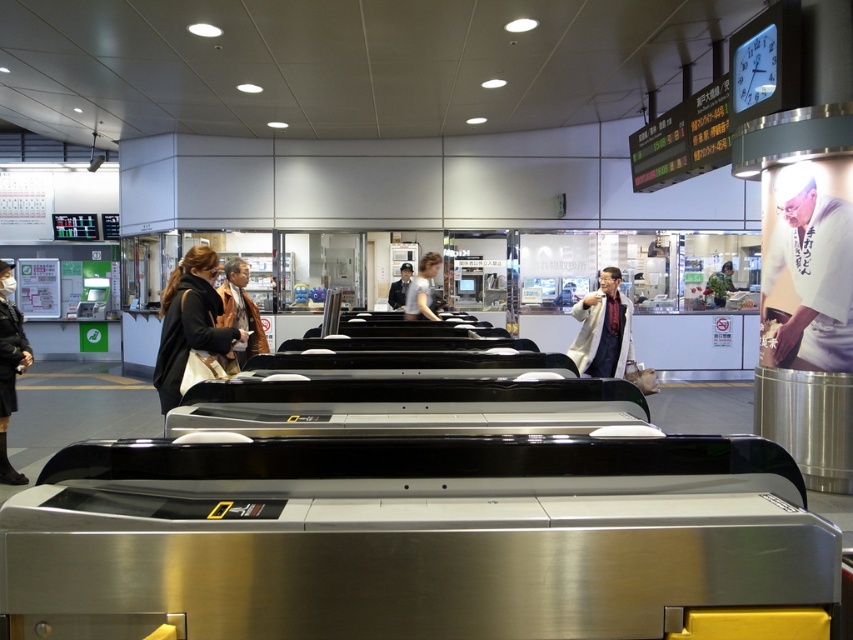
Question: Which object appears closest to the camera in this image?

Choices:
 (A) dark blue suit at center
 (B) white cotton shirt at upper right
 (C) matte black coat at center
 (D) light brown leather jacket at upper right

Answer: (C)

Question: From the image, what is the correct spatial relationship of brown leather jacket at center in relation to matte black jacket at center?

Choices:
 (A) below
 (B) above

Answer: (A)

Question: Where is light brown leather jacket at upper right located in relation to dark blue suit at center in the image?

Choices:
 (A) below
 (B) above

Answer: (B)

Question: In this image, where is matte black jacket at center located relative to light brown leather jacket at upper right?

Choices:
 (A) below
 (B) above

Answer: (A)

Question: Which point is farther to the camera?

Choices:
 (A) light brown leather jacket at upper right
 (B) matte black coat at center
 (C) matte black jacket at left
 (D) matte black jacket at center

Answer: (A)

Question: Which point is closer to the camera?

Choices:
 (A) matte black jacket at left
 (B) dark blue suit at center

Answer: (A)